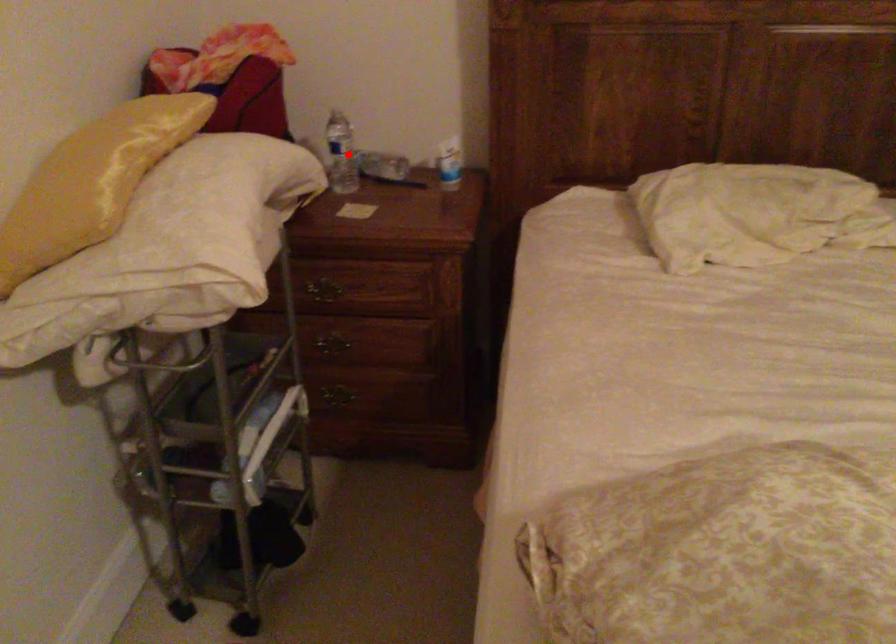
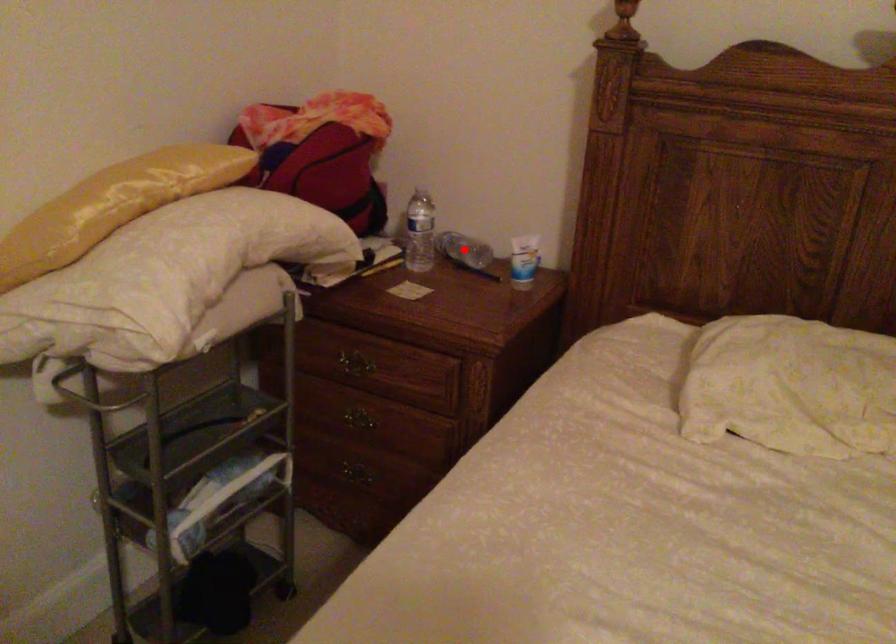
I am providing you with two images of the same scene from different viewpoints. A red point is marked on the first image and another point is marked on the second image. Do the highlighted points in image1 and image2 indicate the same real-world spot?

No